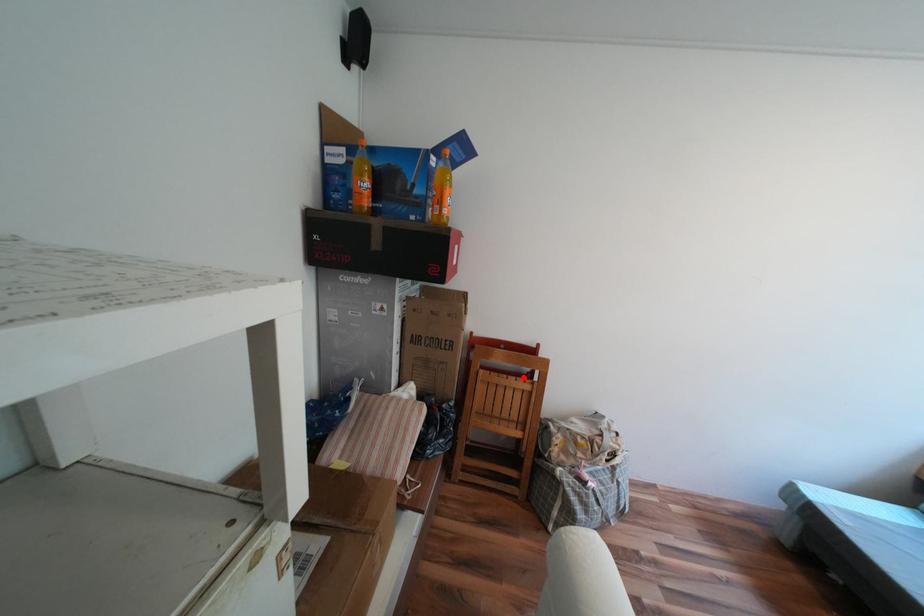
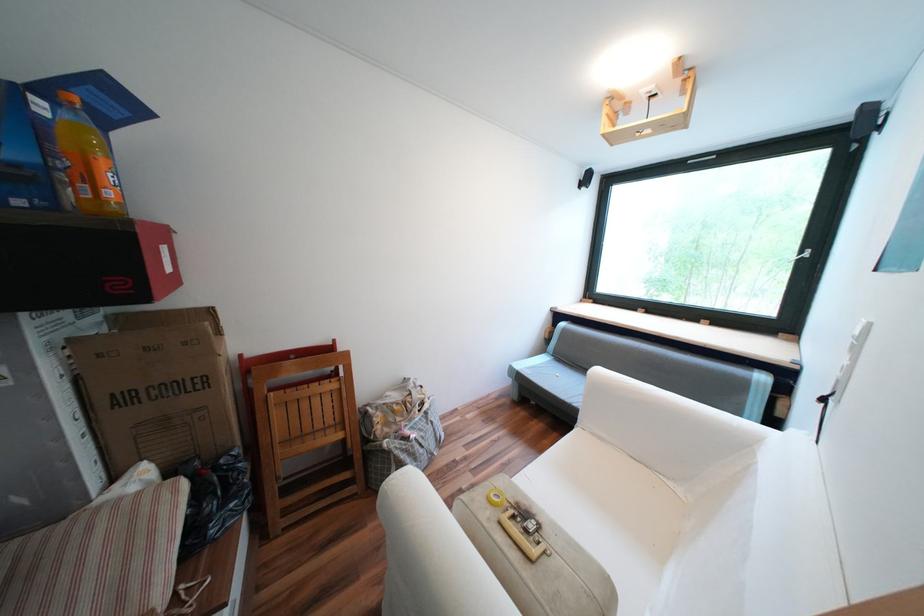
Find the pixel in the second image that matches the highlighted location in the first image.

(325, 383)